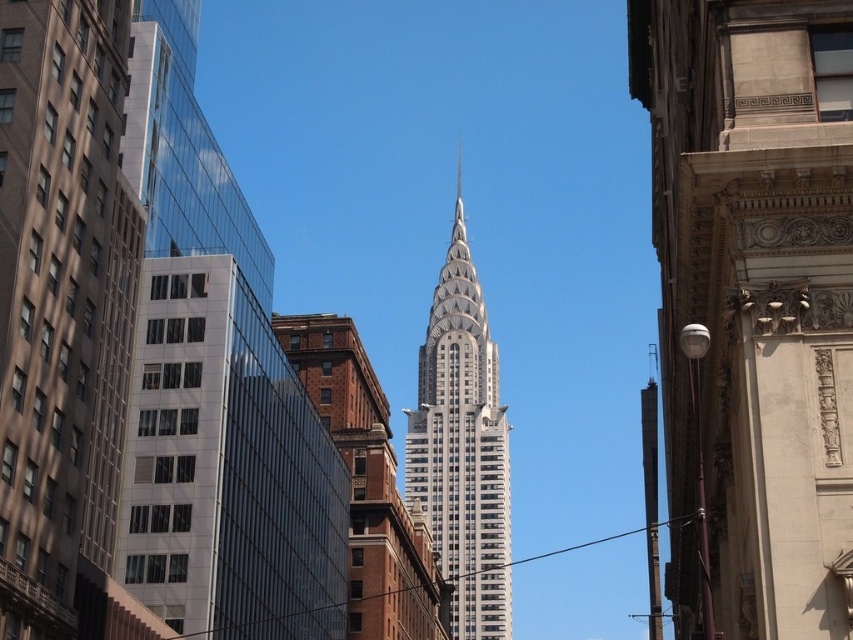
Describe the element at coordinates (216, 387) in the screenshot. I see `glassy reflective skyscraper at left` at that location.

Is glassy reflective skyscraper at left positioned at the back of matte glass building at left?

Yes, glassy reflective skyscraper at left is behind matte glass building at left.

Find the location of a particular element. The height and width of the screenshot is (640, 853). glassy reflective skyscraper at left is located at coordinates (216, 387).

Which is behind, point (294, 460) or point (438, 476)?

Point (438, 476)

Does glassy reflective skyscraper at left have a greater width compared to silver metallic skyscraper at center?

Incorrect, glassy reflective skyscraper at left's width does not surpass silver metallic skyscraper at center's.

Identify the location of glassy reflective skyscraper at left. The height and width of the screenshot is (640, 853). (216, 387).

Is point (99, 276) farther from camera compared to point (457, 474)?

No, (99, 276) is closer to viewer.

Who is lower down, matte glass building at left or silver metallic skyscraper at center?

silver metallic skyscraper at center is below.

In the scene shown: Who is more forward, (x=67, y=392) or (x=461, y=336)?

Point (x=67, y=392) is more forward.

Locate an element on the screen. The height and width of the screenshot is (640, 853). matte glass building at left is located at coordinates pyautogui.click(x=64, y=317).